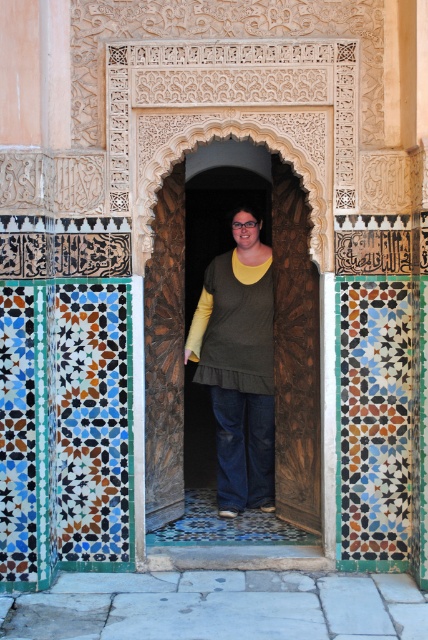
Question: Which of the following is the farthest from the observer?

Choices:
 (A) wooden door at center
 (B) dark green fabric shirt at center

Answer: (B)

Question: Is wooden door at center below dark green fabric shirt at center?

Choices:
 (A) yes
 (B) no

Answer: (B)

Question: Considering the relative positions of wooden door at center and dark green fabric shirt at center in the image provided, where is wooden door at center located with respect to dark green fabric shirt at center?

Choices:
 (A) right
 (B) left

Answer: (A)

Question: Is wooden door at center closer to the viewer compared to dark green fabric shirt at center?

Choices:
 (A) yes
 (B) no

Answer: (A)